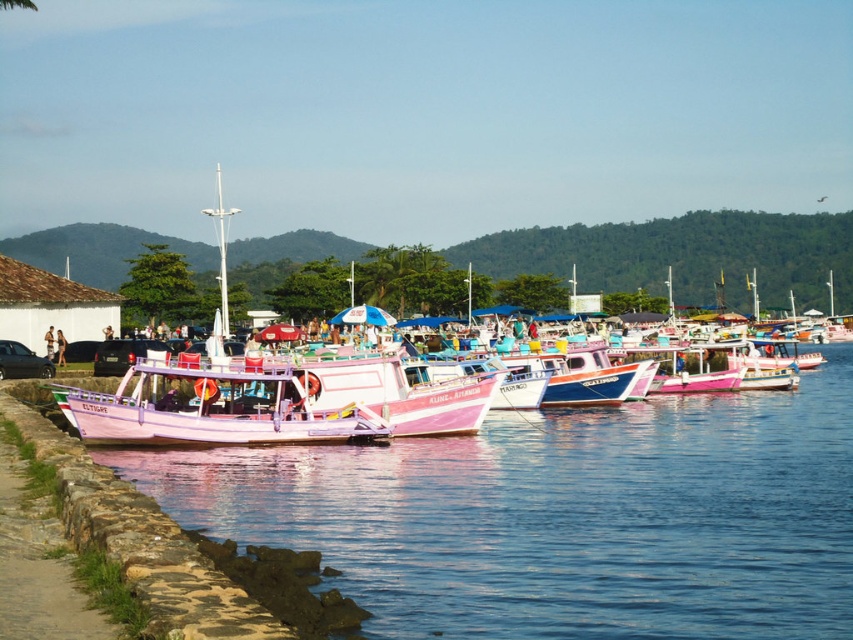
Question: Observing the image, what is the correct spatial positioning of pastel matte boat at center in reference to pink matte boat at center?

Choices:
 (A) right
 (B) left

Answer: (B)

Question: Among these objects, which one is farthest from the camera?

Choices:
 (A) pink matte boat at center
 (B) pastel matte boat at center
 (C) pink fabric person at center

Answer: (C)

Question: Estimate the real-world distances between objects in this image. Which object is closer to the pastel matte boat at center?

Choices:
 (A) pink fabric person at center
 (B) pink matte boat at center

Answer: (B)

Question: Which point is closer to the camera?

Choices:
 (A) pink fabric person at center
 (B) pink matte boat at center
 (C) pastel matte boat at center

Answer: (C)

Question: Is pastel matte boat at center to the right of pink matte boat at center from the viewer's perspective?

Choices:
 (A) no
 (B) yes

Answer: (A)

Question: Does pastel matte boat at center appear on the left side of pink fabric person at center?

Choices:
 (A) no
 (B) yes

Answer: (A)